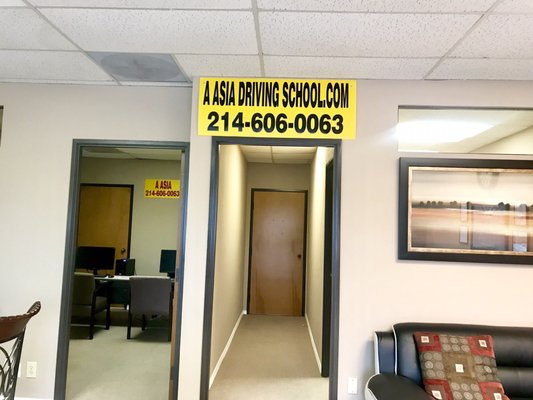
Where is `doorway`? This screenshot has width=533, height=400. doorway is located at coordinates (x=66, y=369).